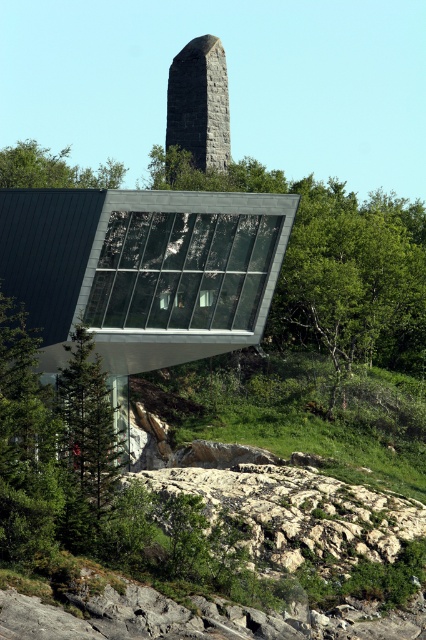
Is granite stone obelisk at upper center above green leafy tree at upper left?

No, granite stone obelisk at upper center is not above green leafy tree at upper left.

Is granite stone obelisk at upper center taller than green leafy tree at upper left?

Incorrect, granite stone obelisk at upper center's height is not larger of green leafy tree at upper left's.

Identify the location of granite stone obelisk at upper center. (199, 102).